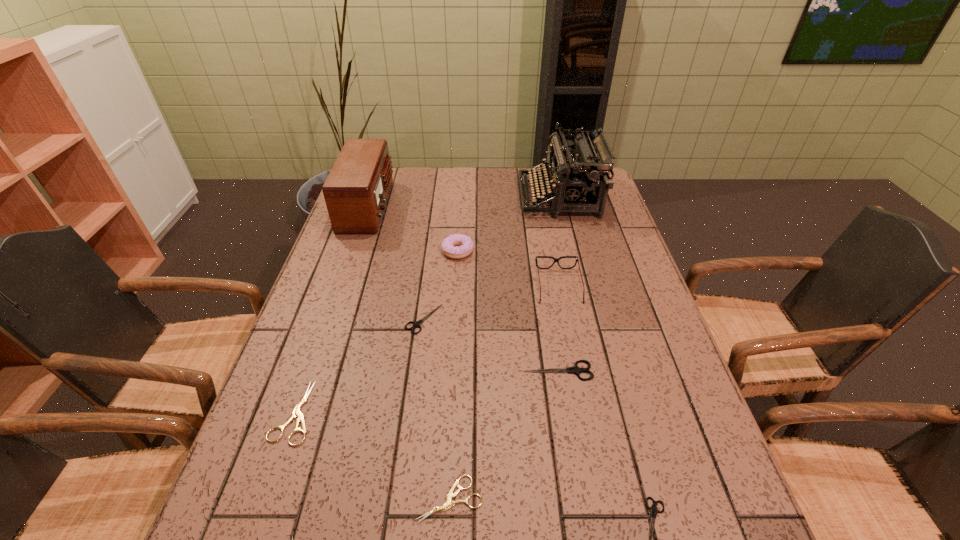
Identify the location of free space located 0.270m on the front of the second biggest black shears. The width and height of the screenshot is (960, 540). (409, 437).

In order to click on vacant space located on the back of the leftmost shears in this screenshot , I will do `click(338, 289)`.

The height and width of the screenshot is (540, 960). In order to click on vacant region located on the right of the rightmost beige shears in this screenshot , I will do click(x=642, y=499).

The image size is (960, 540). I want to click on typewriter present at the far edge, so point(582,177).

Where is `radio receiver present at the far edge`? This screenshot has height=540, width=960. radio receiver present at the far edge is located at coordinates (356, 190).

Where is `radio receiver present at the left edge`? This screenshot has height=540, width=960. radio receiver present at the left edge is located at coordinates click(x=356, y=190).

Where is `shears located at the left edge`? shears located at the left edge is located at coordinates (296, 412).

At what (x,y) coordinates should I click in order to perform the action: click on object that is at the right edge. Please return your answer as a coordinate pair (x, y). Image resolution: width=960 pixels, height=540 pixels. Looking at the image, I should click on (582, 177).

You are a GUI agent. You are given a task and a screenshot of the screen. Output one action in this format:
    pyautogui.click(x=<x>, y=<y>)
    Task: Click on the object that is at the far left corner
    
    Given the screenshot: What is the action you would take?
    pyautogui.click(x=356, y=190)

Image resolution: width=960 pixels, height=540 pixels. Find the location of `object at the far right corner`. object at the far right corner is located at coordinates (582, 177).